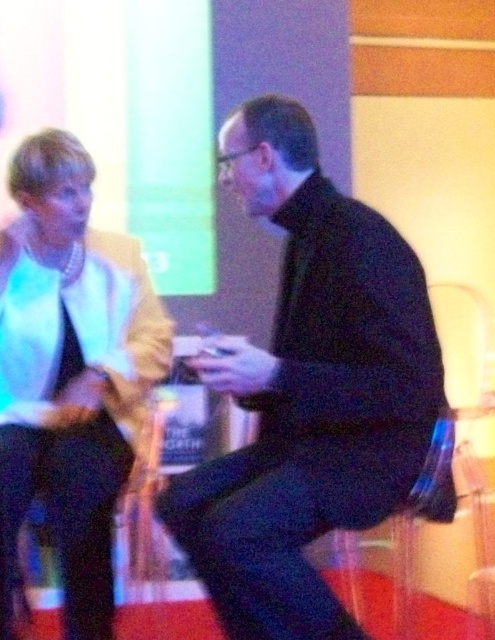
You are a photographer standing 5 feet away from the two people in the image. You need to capture a photo where both the black matte jacket at center and the matte white jacket at left are in focus. Given that your camera has a depth of field that can sharply focus objects within a 20 inch range, will both jackets be in focus?

The distance between the black matte jacket at center and the matte white jacket at left is 20.36 inches. Since the camera can only sharply focus within a 20 inch range, the jackets are slightly beyond this range, so they might not both be in focus simultaneously.